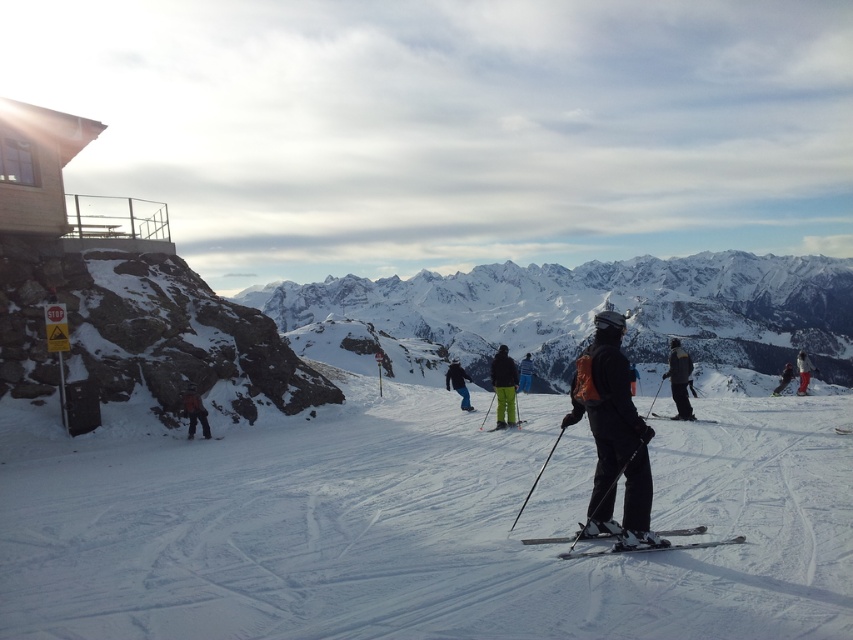
You are a skier planning to descend the slope and want to avoid the white powder snow at center. Where should you aim to go instead?

The white powder snow at center is located at point (430, 529), so you should aim to go to areas not at that coordinate to avoid it.